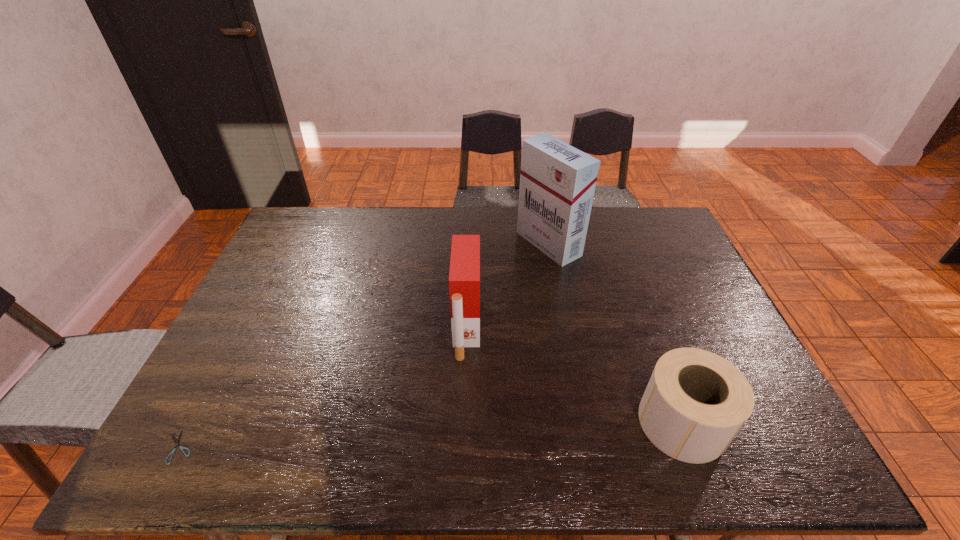
Find the location of a particular element. This screenshot has height=540, width=960. empty space that is in between the farthest object and the shortest object is located at coordinates (364, 346).

Identify the location of empty space between the right cigarette case and the shortest object. (364, 346).

Locate an element on the screen. The width and height of the screenshot is (960, 540). vacant space in between the second tallest object and the shears is located at coordinates (323, 388).

The image size is (960, 540). In order to click on vacant space that's between the leftmost object and the second shortest object in this screenshot , I will do `click(431, 435)`.

At what (x,y) coordinates should I click in order to perform the action: click on free space between the second tallest object and the rightmost object. Please return your answer as a coordinate pair (x, y). The image size is (960, 540). Looking at the image, I should click on (574, 375).

The image size is (960, 540). I want to click on object that is the second closest to the shorter cigarette case, so click(695, 403).

Identify which object is the second closest to the second object from right to left. Please provide its 2D coordinates. Your answer should be formatted as a tuple, i.e. [(x, y)], where the tuple contains the x and y coordinates of a point satisfying the conditions above.

[(695, 403)]

I want to click on vacant area in the image that satisfies the following two spatial constraints: 1. on the back side of the shears; 2. on the right side of the farther cigarette case, so click(287, 244).

Find the location of a particular element. free spot that satisfies the following two spatial constraints: 1. on the back side of the rightmost object; 2. on the front-facing side of the nearer cigarette case is located at coordinates (647, 328).

Where is `free region that satisfies the following two spatial constraints: 1. on the back side of the farthest object; 2. on the right side of the shortest object`? The image size is (960, 540). free region that satisfies the following two spatial constraints: 1. on the back side of the farthest object; 2. on the right side of the shortest object is located at coordinates (287, 244).